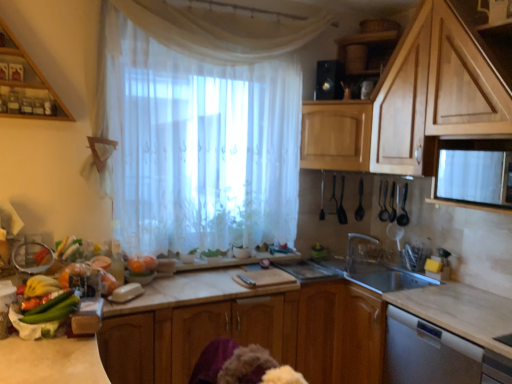
Image resolution: width=512 pixels, height=384 pixels. I want to click on free point below black matte microwave at upper right (from a real-world perspective), so click(x=482, y=298).